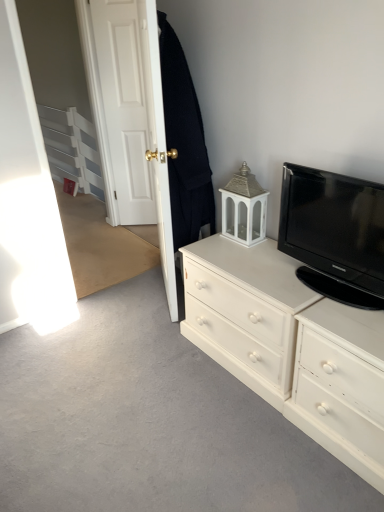
Describe the element at coordinates (334, 234) in the screenshot. This screenshot has height=512, width=384. I see `black glossy tv at upper right` at that location.

What do you see at coordinates (126, 106) in the screenshot? I see `white wood door at upper left, which appears as the 2th door when viewed from the right` at bounding box center [126, 106].

The width and height of the screenshot is (384, 512). In order to click on white wooden door at upper left, acting as the 1th door starting from the right in this screenshot , I will do `click(130, 116)`.

What is the approximate height of white wooden door at upper left, acting as the second door starting from the left?

white wooden door at upper left, acting as the second door starting from the left, is 1.80 meters tall.

Describe the element at coordinates (340, 391) in the screenshot. I see `white painted wood drawer at right` at that location.

The width and height of the screenshot is (384, 512). Find the location of `black woolen robe at upper left`. black woolen robe at upper left is located at coordinates (184, 143).

The width and height of the screenshot is (384, 512). I want to click on black glossy tv at upper right, so click(334, 234).

Is white wood door at upper left, which is counted as the first door, starting from the left, outside of white wooden door at upper left, acting as the 1th door starting from the right?

Yes, white wood door at upper left, which is counted as the first door, starting from the left, is not within white wooden door at upper left, acting as the 1th door starting from the right.

Is white wood door at upper left, which appears as the 2th door when viewed from the right, at the left side of white wooden door at upper left, acting as the second door starting from the left?

Yes.

Considering the sizes of white wood door at upper left, which appears as the 2th door when viewed from the right, and white wooden door at upper left, acting as the 1th door starting from the right, in the image, is white wood door at upper left, which appears as the 2th door when viewed from the right, taller or shorter than white wooden door at upper left, acting as the 1th door starting from the right,?

In the image, white wood door at upper left, which appears as the 2th door when viewed from the right, appears to be shorter than white wooden door at upper left, acting as the 1th door starting from the right.

In the scene shown: Is white wood door at upper left, which appears as the 2th door when viewed from the right, far from white painted wood drawer at right?

Absolutely, white wood door at upper left, which appears as the 2th door when viewed from the right, is distant from white painted wood drawer at right.

Is white wood door at upper left, which is counted as the first door, starting from the left, shorter than white painted wood drawer at right?

In fact, white wood door at upper left, which is counted as the first door, starting from the left, may be taller than white painted wood drawer at right.

What are the coordinates of `the 2nd door to the left of the white painted wood drawer at right, starting your count from the anchor` in the screenshot? It's located at (126, 106).

Which is more to the right, white wood door at upper left, which appears as the 2th door when viewed from the right, or white painted wood drawer at right?

Positioned to the right is white painted wood drawer at right.

Is black woolen robe at upper left shorter than black glossy tv at upper right?

Incorrect, the height of black woolen robe at upper left does not fall short of that of black glossy tv at upper right.

Based on the photo, from the image's perspective, between black woolen robe at upper left and black glossy tv at upper right, which one is located above?

black woolen robe at upper left is shown above in the image.

Is black woolen robe at upper left not inside black glossy tv at upper right?

That's correct, black woolen robe at upper left is outside of black glossy tv at upper right.

Is black woolen robe at upper left placed right next to black glossy tv at upper right?

No, black woolen robe at upper left is not touching black glossy tv at upper right.

Does white wooden door at upper left, acting as the 1th door starting from the right, appear on the right side of white painted wood drawer at right?

No.

Based on the photo, what's the angular difference between white wooden door at upper left, acting as the second door starting from the left, and white painted wood drawer at right's facing directions?

The angular difference between white wooden door at upper left, acting as the second door starting from the left, and white painted wood drawer at right is 0.888 degrees.

Between white wooden door at upper left, acting as the 1th door starting from the right, and white painted wood drawer at right, which one has less height?

With less height is white painted wood drawer at right.

Measure the distance between white painted wood chest of drawers at right and black glossy tv at upper right.

They are 11.93 inches apart.

What's the angular difference between white painted wood chest of drawers at right and black glossy tv at upper right's facing directions?

The angle between the facing direction of white painted wood chest of drawers at right and the facing direction of black glossy tv at upper right is 0.813 degrees.

What are the coordinates of `chest of drawers on the left of the black glossy tv at upper right` in the screenshot? It's located at (291, 346).

Consider the image. Which of these two, white painted wood chest of drawers at right or black glossy tv at upper right, is thinner?

With smaller width is black glossy tv at upper right.

Which object is more forward, black glossy tv at upper right or white wooden door at upper left, acting as the second door starting from the left?

black glossy tv at upper right is more forward.

Is white wooden door at upper left, acting as the 1th door starting from the right, located within black glossy tv at upper right?

That's incorrect, white wooden door at upper left, acting as the 1th door starting from the right, is not inside black glossy tv at upper right.

Between point (361, 280) and point (125, 144), which one is positioned in front?

The point (361, 280) is more forward.

From a real-world perspective, relative to white wooden door at upper left, acting as the second door starting from the left, is black glossy tv at upper right vertically above or below?

black glossy tv at upper right is below white wooden door at upper left, acting as the second door starting from the left.

Does white painted wood drawer at right come in front of black glossy tv at upper right?

Yes, white painted wood drawer at right is closer to the camera.

Is white painted wood drawer at right located outside black glossy tv at upper right?

Yes, white painted wood drawer at right is located beyond the bounds of black glossy tv at upper right.

Looking at this image, is there a large distance between white painted wood drawer at right and black glossy tv at upper right?

No, there isn't a large distance between white painted wood drawer at right and black glossy tv at upper right.

Considering the sizes of white painted wood drawer at right and black glossy tv at upper right in the image, is white painted wood drawer at right wider or thinner than black glossy tv at upper right?

Clearly, white painted wood drawer at right has more width compared to black glossy tv at upper right.

The width and height of the screenshot is (384, 512). In the image, there is a white wood door at upper left, which appears as the 2th door when viewed from the right. Find the location of `door below it (from the image's perspective)`. door below it (from the image's perspective) is located at coordinates (130, 116).

Find the location of a particular element. Image resolution: width=384 pixels, height=512 pixels. drawer that appears on the right of white wood door at upper left, which is counted as the first door, starting from the left is located at coordinates (340, 391).

Which object lies nearer to the anchor point white wooden door at upper left, acting as the second door starting from the left, black glossy tv at upper right or white wood door at upper left, which is counted as the first door, starting from the left?

white wood door at upper left, which is counted as the first door, starting from the left.

Estimate the real-world distances between objects in this image. Which object is further from white wooden door at upper left, acting as the second door starting from the left, white painted wood drawer at right or white painted wood chest of drawers at right?

white painted wood drawer at right is further to white wooden door at upper left, acting as the second door starting from the left.

Looking at the image, which one is located further to white wood door at upper left, which appears as the 2th door when viewed from the right, white wooden door at upper left, acting as the 1th door starting from the right, or white painted wood chest of drawers at right?

Based on the image, white painted wood chest of drawers at right appears to be further to white wood door at upper left, which appears as the 2th door when viewed from the right.

Based on the photo, considering their positions, is white painted wood drawer at right positioned closer to black woolen robe at upper left than white wood door at upper left, which is counted as the first door, starting from the left?

Among the two, white painted wood drawer at right is located nearer to black woolen robe at upper left.

Looking at the image, which one is located closer to black glossy tv at upper right, white painted wood drawer at right or white wooden door at upper left, acting as the 1th door starting from the right?

white painted wood drawer at right is positioned closer to the anchor black glossy tv at upper right.

When comparing their distances from black glossy tv at upper right, does white painted wood chest of drawers at right or black woolen robe at upper left seem further?

Among the two, black woolen robe at upper left is located further to black glossy tv at upper right.

Which object lies further to the anchor point white painted wood drawer at right, black glossy tv at upper right or black woolen robe at upper left?

The object further to white painted wood drawer at right is black woolen robe at upper left.

Based on their spatial positions, is white wooden door at upper left, acting as the second door starting from the left, or black glossy tv at upper right further from white wood door at upper left, which appears as the 2th door when viewed from the right?

black glossy tv at upper right is positioned further to the anchor white wood door at upper left, which appears as the 2th door when viewed from the right.

Image resolution: width=384 pixels, height=512 pixels. In order to click on television between white wooden door at upper left, acting as the 1th door starting from the right, and white painted wood chest of drawers at right, in the vertical direction in this screenshot , I will do `click(334, 234)`.

The image size is (384, 512). I want to click on door between white wood door at upper left, which appears as the 2th door when viewed from the right, and white painted wood chest of drawers at right vertically, so click(x=130, y=116).

Identify the location of television located between white painted wood drawer at right and white wood door at upper left, which is counted as the first door, starting from the left, in the depth direction. (334, 234).

You are a GUI agent. You are given a task and a screenshot of the screen. Output one action in this format:
    pyautogui.click(x=<x>, y=<y>)
    Task: Click on the door between white wood door at upper left, which appears as the 2th door when viewed from the right, and white painted wood drawer at right, in the vertical direction
    This screenshot has height=512, width=384.
    Given the screenshot: What is the action you would take?
    pyautogui.click(x=130, y=116)